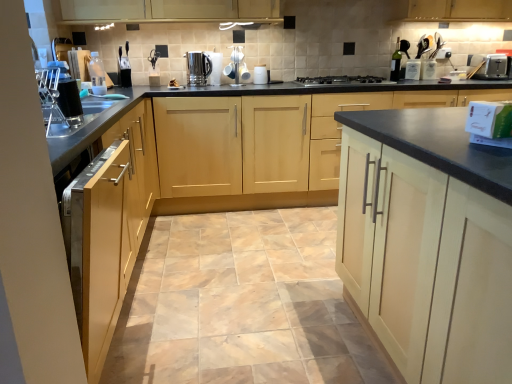
What are the coordinates of `vacant area that is in front of transparent plastic bottle at upper left, the 2th bottle from the top` in the screenshot? It's located at (93, 96).